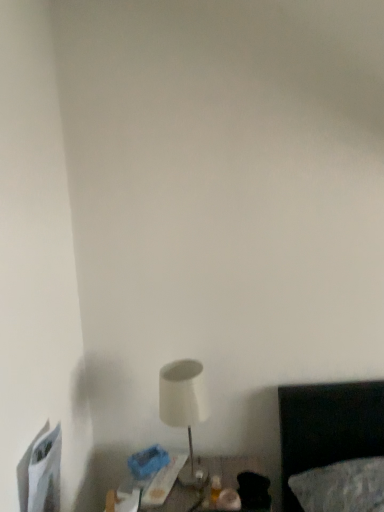
What do you see at coordinates (184, 409) in the screenshot? This screenshot has width=384, height=512. I see `white matte lamp at center` at bounding box center [184, 409].

Measure the distance between point (181, 413) and camera.

A distance of 1.29 meters exists between point (181, 413) and camera.

Where is `white matte lamp at center`? The image size is (384, 512). white matte lamp at center is located at coordinates (184, 409).

Image resolution: width=384 pixels, height=512 pixels. Identify the location of white matte lamp at center. (184, 409).